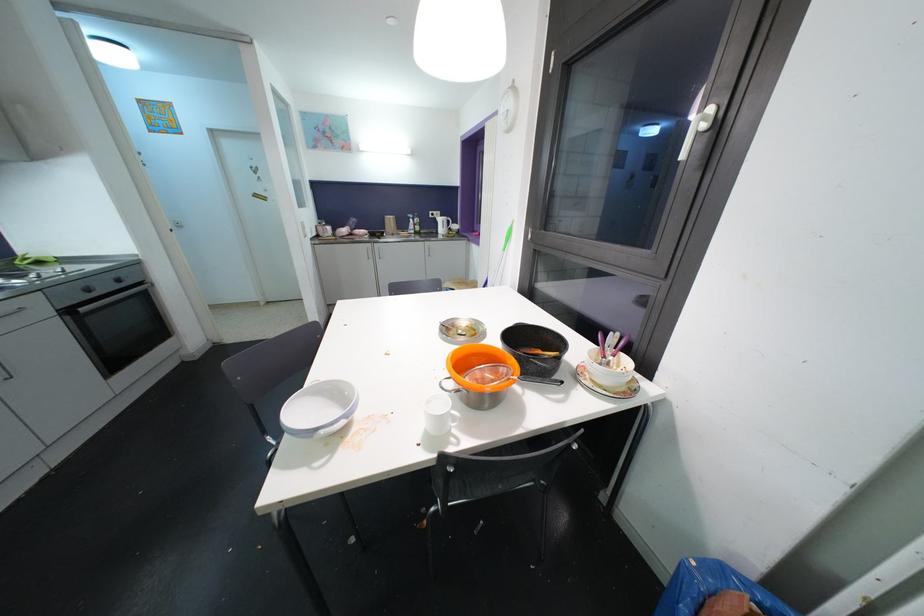
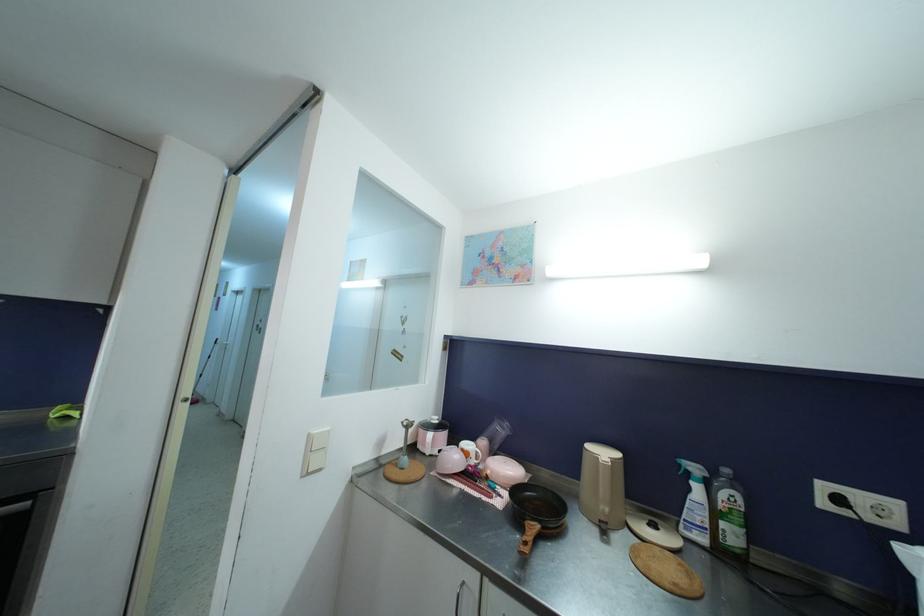
Find the pixel in the second image that matches (x=433, y=219) in the first image.

(827, 507)